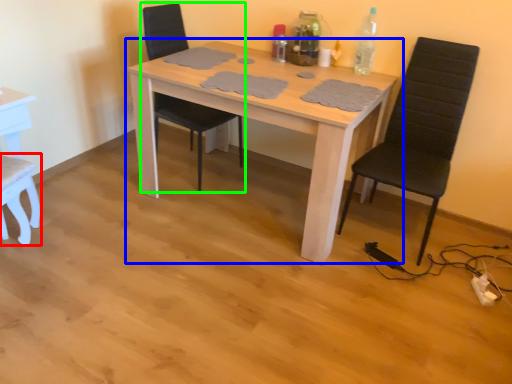
Question: Which object is positioned farthest from chair (highlighted by a red box)? Select from table (highlighted by a blue box) and chair (highlighted by a green box).

Choices:
 (A) table
 (B) chair

Answer: (A)